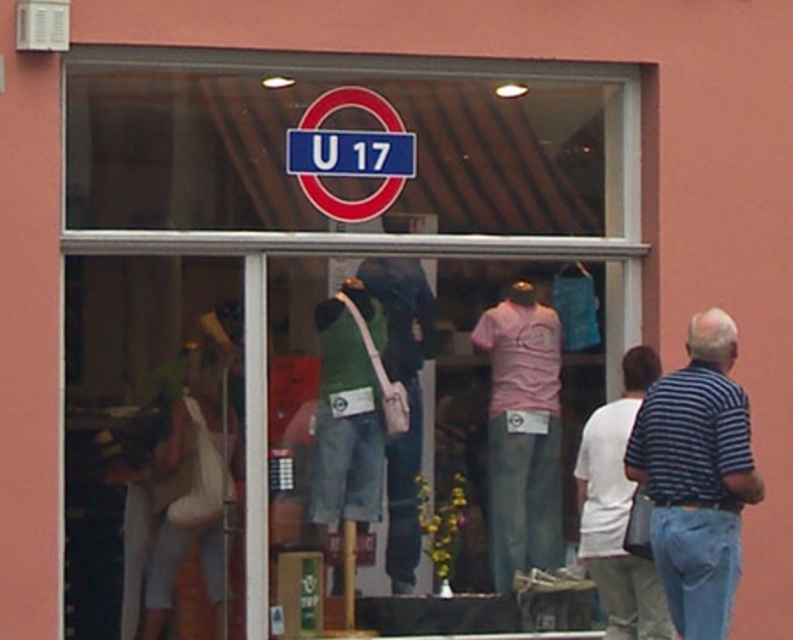
Question: Is transparent glass at center smaller than striped cotton shirt at right?

Choices:
 (A) yes
 (B) no

Answer: (B)

Question: Which point is farther to the camera?

Choices:
 (A) (311, 588)
 (B) (711, 548)

Answer: (A)

Question: Which point appears farthest from the camera in this image?

Choices:
 (A) (71, 381)
 (B) (606, 547)

Answer: (A)

Question: Which point is closer to the camera?

Choices:
 (A) transparent glass at center
 (B) striped cotton shirt at right
 (C) white cotton t-shirt at right

Answer: (B)

Question: Does striped cotton shirt at right appear on the right side of white cotton t-shirt at right?

Choices:
 (A) yes
 (B) no

Answer: (A)

Question: Where is striped cotton shirt at right located in relation to white cotton t-shirt at right in the image?

Choices:
 (A) left
 (B) right

Answer: (B)